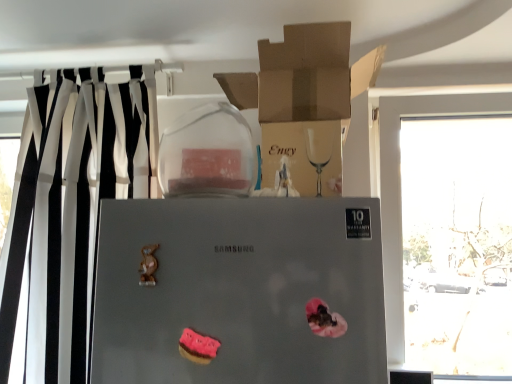
Locate an element on the screen. satin silver refrigerator at center is located at coordinates (239, 290).

The image size is (512, 384). In order to click on pink frosted cookie at lower center in this screenshot , I will do `click(198, 347)`.

Find the location of a particular element. The image size is (512, 384). satin silver refrigerator at center is located at coordinates (239, 290).

Can you confirm if transparent glass window at right is wider than black/white striped curtain at left?

Incorrect, the width of transparent glass window at right does not surpass that of black/white striped curtain at left.

How far apart are transparent glass window at right and black/white striped curtain at left?

transparent glass window at right is 1.06 meters from black/white striped curtain at left.

In terms of height, does transparent glass window at right look taller or shorter compared to black/white striped curtain at left?

Clearly, transparent glass window at right is shorter compared to black/white striped curtain at left.

How different are the orientations of transparent glass window at right and black/white striped curtain at left in degrees?

The angle between the facing direction of transparent glass window at right and the facing direction of black/white striped curtain at left is 1.55 degrees.

Does point (113, 374) appear closer or farther from the camera than point (105, 84)?

Point (113, 374).

Choose the correct answer: Is satin silver refrigerator at center inside black/white striped curtain at left or outside it?

satin silver refrigerator at center is not enclosed by black/white striped curtain at left.

From their relative heights in the image, would you say satin silver refrigerator at center is taller or shorter than black/white striped curtain at left?

Considering their sizes, satin silver refrigerator at center has less height than black/white striped curtain at left.

In the scene shown: Is satin silver refrigerator at center positioned far away from black/white striped curtain at left?

satin silver refrigerator at center is near black/white striped curtain at left, not far away.

Is pink frosted cookie at lower center at the back of black/white striped curtain at left?

black/white striped curtain at left is not turned away from pink frosted cookie at lower center.

Does point (41, 190) come behind point (187, 335)?

Yes, point (41, 190) is farther from viewer.

Are black/white striped curtain at left and pink frosted cookie at lower center located far from each other?

They are positioned close to each other.

In the image, there is a pink frosted cookie at lower center. Where is `curtain above it (from the image's perspective)`? curtain above it (from the image's perspective) is located at coordinates (69, 209).

Consider the image. From the image's perspective, is transparent glass window at right located above or below satin silver refrigerator at center?

transparent glass window at right is situated higher than satin silver refrigerator at center in the image.

Is point (393, 352) closer or farther from the camera than point (258, 236)?

Point (393, 352) is positioned farther from the camera compared to point (258, 236).

Which is more to the left, transparent glass window at right or satin silver refrigerator at center?

satin silver refrigerator at center is more to the left.

Can we say transparent glass window at right lies outside satin silver refrigerator at center?

Indeed, transparent glass window at right is completely outside satin silver refrigerator at center.

From the image's perspective, which is below, brown cardboard box at upper center or black/white striped curtain at left?

black/white striped curtain at left appears lower in the image.

Looking at this image, in the image, is brown cardboard box at upper center positioned in front of or behind black/white striped curtain at left?

brown cardboard box at upper center is in front of black/white striped curtain at left.

The image size is (512, 384). Find the location of `box located in front of the black/white striped curtain at left`. box located in front of the black/white striped curtain at left is located at coordinates (304, 104).

Which is correct: brown cardboard box at upper center is inside black/white striped curtain at left, or outside of it?

The correct answer is: outside.

Can you tell me how much pink frosted cookie at lower center and brown cardboard box at upper center differ in facing direction?

The angular difference between pink frosted cookie at lower center and brown cardboard box at upper center is 2.55 degrees.

In the scene shown: Is pink frosted cookie at lower center not inside brown cardboard box at upper center?

Yes, pink frosted cookie at lower center is not within brown cardboard box at upper center.

Is pink frosted cookie at lower center turned away from brown cardboard box at upper center?

That's not correct — pink frosted cookie at lower center is not looking away from brown cardboard box at upper center.

Considering the relative sizes of satin silver refrigerator at center and pink frosted cookie at lower center in the image provided, is satin silver refrigerator at center bigger than pink frosted cookie at lower center?

Yes.

Does satin silver refrigerator at center lie behind pink frosted cookie at lower center?

No, satin silver refrigerator at center is closer to the camera.

From the picture: From the image's perspective, is satin silver refrigerator at center under pink frosted cookie at lower center?

No, from the image's perspective, satin silver refrigerator at center is not below pink frosted cookie at lower center.

Image resolution: width=512 pixels, height=384 pixels. I want to click on window located below the black/white striped curtain at left (from the image's perspective), so click(400, 177).

Where is `curtain on the left of the satin silver refrigerator at center`? Image resolution: width=512 pixels, height=384 pixels. curtain on the left of the satin silver refrigerator at center is located at coordinates (69, 209).

Estimate the real-world distances between objects in this image. Which object is closer to brown cardboard box at upper center, transparent glass window at right or pink frosted cookie at lower center?

Among the two, transparent glass window at right is located nearer to brown cardboard box at upper center.

Looking at this image, based on their spatial positions, is black/white striped curtain at left or transparent glass window at right further from brown cardboard box at upper center?

Among the two, black/white striped curtain at left is located further to brown cardboard box at upper center.

Estimate the real-world distances between objects in this image. Which object is closer to transparent glass window at right, satin silver refrigerator at center or pink frosted cookie at lower center?

satin silver refrigerator at center.

Which object lies further to the anchor point transparent glass window at right, black/white striped curtain at left or pink frosted cookie at lower center?

black/white striped curtain at left is positioned further to the anchor transparent glass window at right.

Estimate the real-world distances between objects in this image. Which object is further from satin silver refrigerator at center, black/white striped curtain at left or pink frosted cookie at lower center?

black/white striped curtain at left.

Considering their positions, is transparent glass window at right positioned closer to black/white striped curtain at left than pink frosted cookie at lower center?

The object closer to black/white striped curtain at left is pink frosted cookie at lower center.

Considering their positions, is pink frosted cookie at lower center positioned further to brown cardboard box at upper center than transparent glass window at right?

Based on the image, pink frosted cookie at lower center appears to be further to brown cardboard box at upper center.

Based on their spatial positions, is satin silver refrigerator at center or transparent glass window at right closer to pink frosted cookie at lower center?

satin silver refrigerator at center is positioned closer to the anchor pink frosted cookie at lower center.

Where is `stuff between black/white striped curtain at left and transparent glass window at right in the horizontal direction`? stuff between black/white striped curtain at left and transparent glass window at right in the horizontal direction is located at coordinates (198, 347).

Image resolution: width=512 pixels, height=384 pixels. In order to click on refrigerator between black/white striped curtain at left and brown cardboard box at upper center from left to right in this screenshot , I will do `click(239, 290)`.

Image resolution: width=512 pixels, height=384 pixels. I want to click on stuff located between black/white striped curtain at left and brown cardboard box at upper center in the left-right direction, so click(x=198, y=347).

Identify the location of box situated between black/white striped curtain at left and transparent glass window at right from left to right. The image size is (512, 384). (304, 104).